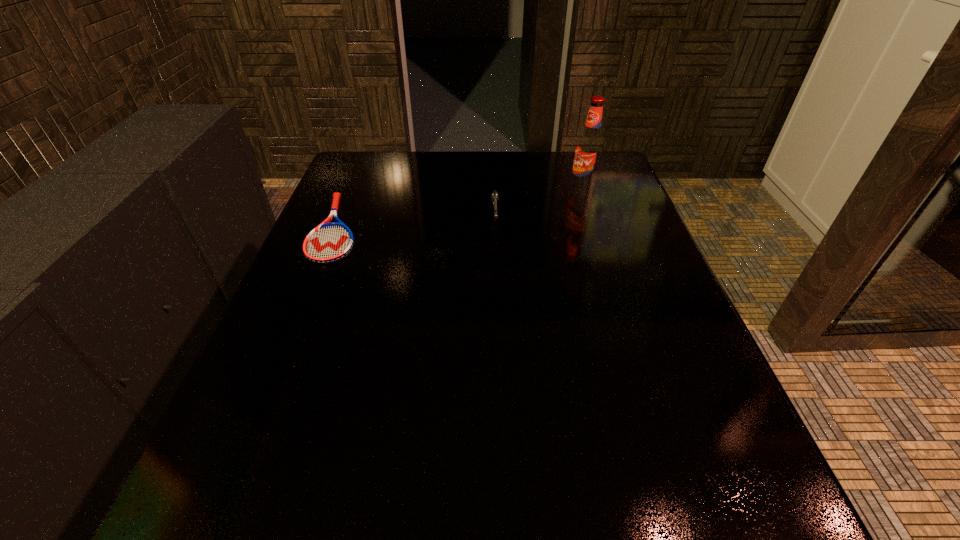
This screenshot has height=540, width=960. Identify the location of object at the left edge. (329, 242).

The width and height of the screenshot is (960, 540). I want to click on object that is at the right edge, so point(589,147).

Identify the location of object that is at the far right corner. The image size is (960, 540). (589, 147).

In the image, there is a desktop. Where is `vacant space at the far edge`? This screenshot has width=960, height=540. vacant space at the far edge is located at coordinates (494, 168).

This screenshot has width=960, height=540. I want to click on vacant space at the near edge of the desktop, so (588, 484).

This screenshot has width=960, height=540. Find the location of `free location at the left edge`. free location at the left edge is located at coordinates (346, 293).

Locate an element on the screen. vacant space at the right edge is located at coordinates click(604, 328).

In the image, there is a desktop. Identify the location of vacant space at the far left corner. The width and height of the screenshot is (960, 540). (367, 192).

Find the location of `blank space at the far right corner of the desktop`. blank space at the far right corner of the desktop is located at coordinates (572, 152).

Where is `blank space at the near right corner`? Image resolution: width=960 pixels, height=540 pixels. blank space at the near right corner is located at coordinates pos(659,501).